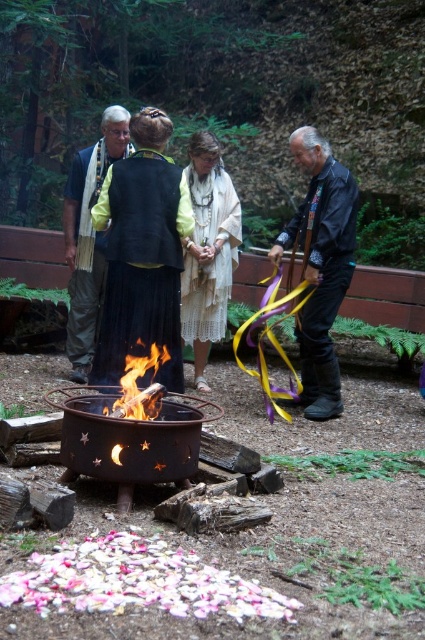
Question: Is black leather jacket at right further to the viewer compared to dark blue scarf at center?

Choices:
 (A) yes
 (B) no

Answer: (B)

Question: Where is white lace dress at center located in relation to dark blue scarf at center in the image?

Choices:
 (A) above
 (B) below

Answer: (B)

Question: Which object appears farthest from the camera in this image?

Choices:
 (A) white lace dress at center
 (B) flamewood at center
 (C) dark blue scarf at center

Answer: (C)

Question: Which object is closer to the camera taking this photo?

Choices:
 (A) black velvet vest at center
 (B) black leather jacket at right
 (C) flamewood at center
 (D) white lace dress at center

Answer: (C)

Question: Does black velvet vest at center appear over white lace dress at center?

Choices:
 (A) no
 (B) yes

Answer: (A)

Question: Which object is the closest to the dark blue scarf at center?

Choices:
 (A) flamewood at center
 (B) white lace dress at center
 (C) black velvet vest at center
 (D) black leather jacket at right

Answer: (B)